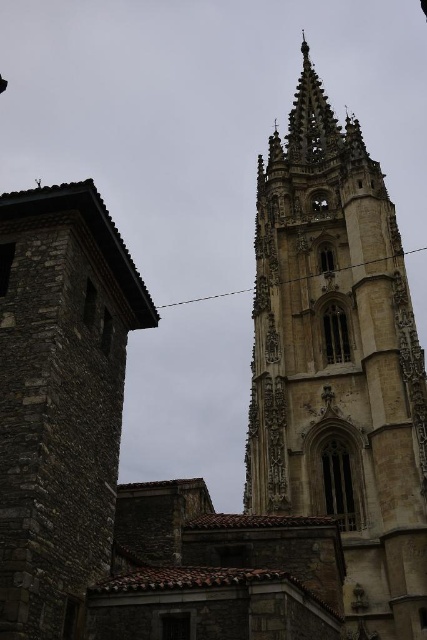
You are standing in the middle of the scene and see the brown stone tower at upper right. Where would you look to find the point marked at coordinate (339, 364)?

The point marked at coordinate (339, 364) indicates the location of the brown stone tower at upper right.

What are the coordinates of the brown stone tower at upper right?

The coordinates of the brown stone tower at upper right are at point (339, 364).

Consider the image. You are standing at the point with coordinates point [26,355] and want to walk towards the point with coordinates point [409,605]. What is the direction you should head in?

You should head north and east because point [409,605] is behind point [26,355], which implies it is in a northeasterly direction from your current position.